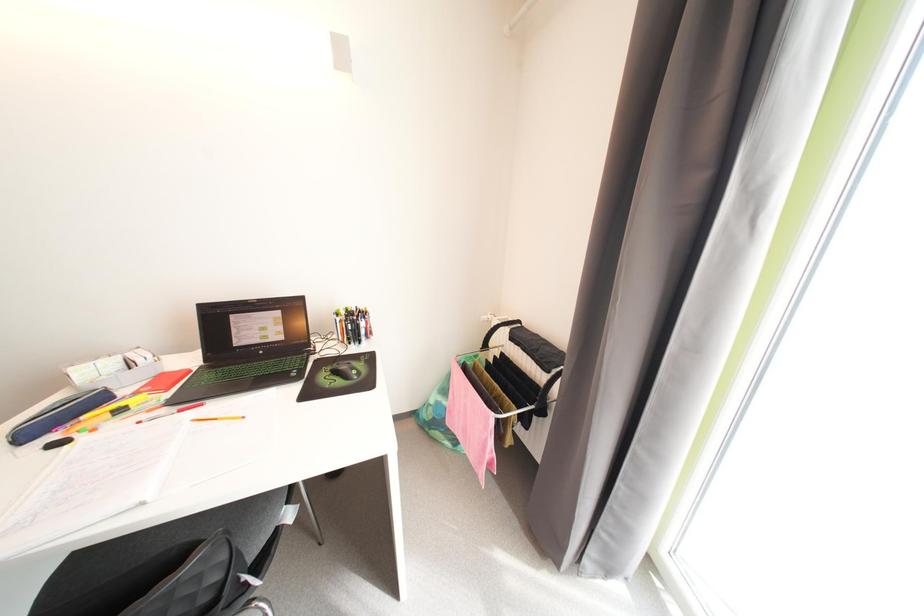
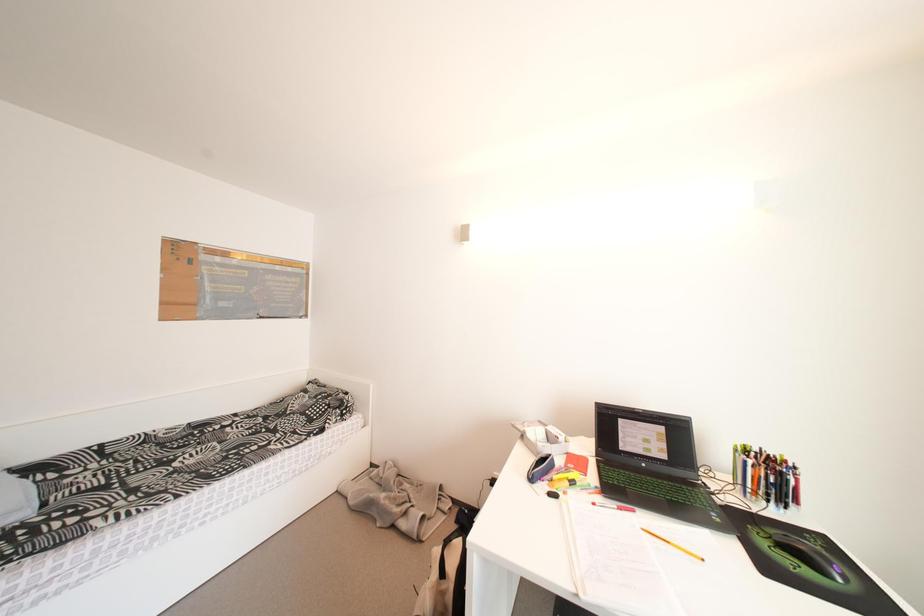
Question: The camera is either moving clockwise (left) or counter-clockwise (right) around the object. The first image is from the beginning of the video and the second image is from the end. Is the camera moving left or right when shooting the video?

Choices:
 (A) Left
 (B) Right

Answer: (B)